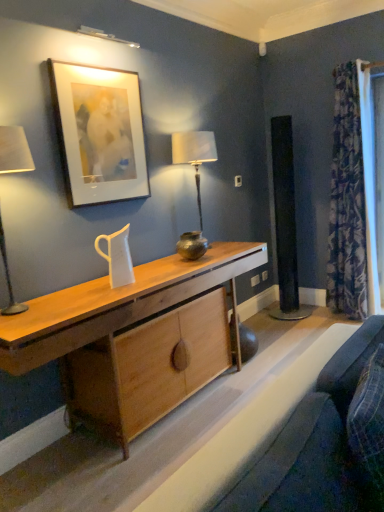
Identify the location of free space in front of shiny metallic vase at center. This screenshot has width=384, height=512. (188, 267).